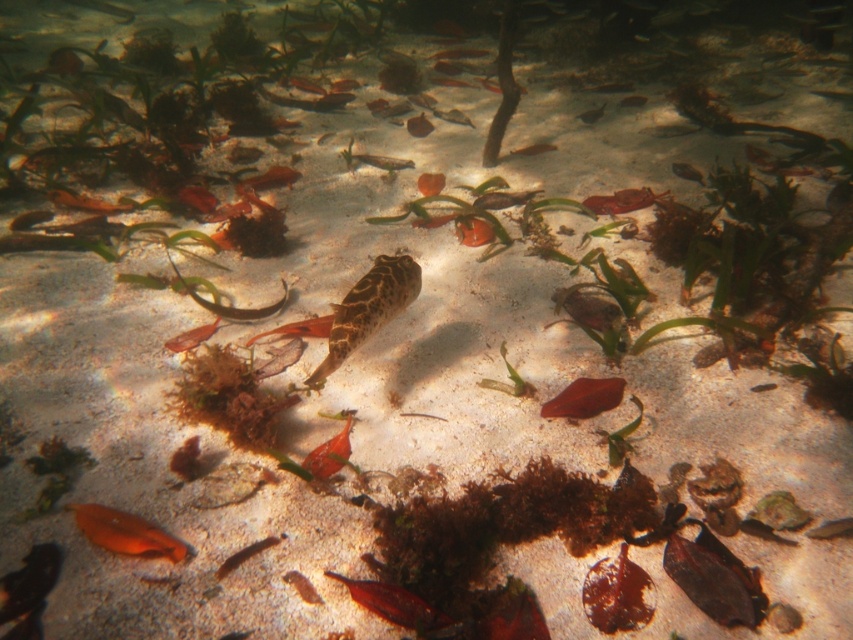
You are a marine biologist observing an underwater scene. You notice a shiny red fish at center in the image. Can you provide the exact coordinates where this fish is located?

The shiny red fish at center is located at coordinates point [393,604].

You are a marine biologist observing an underwater scene. You notice a translucent orange fish at center and a small pufferfish swimming near the center of the frame. How far apart are these two fish?

The translucent orange fish at center and the small pufferfish swimming near the center of the frame are 13.95 feet apart.